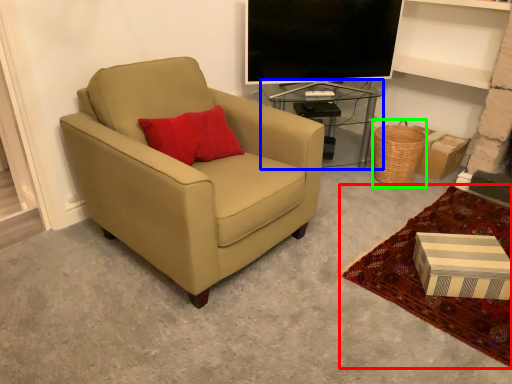
Question: Estimate the real-world distances between objects in this image. Which object is farther from plain (highlighted by a red box), table (highlighted by a blue box) or basket (highlighted by a green box)?

Choices:
 (A) table
 (B) basket

Answer: (A)